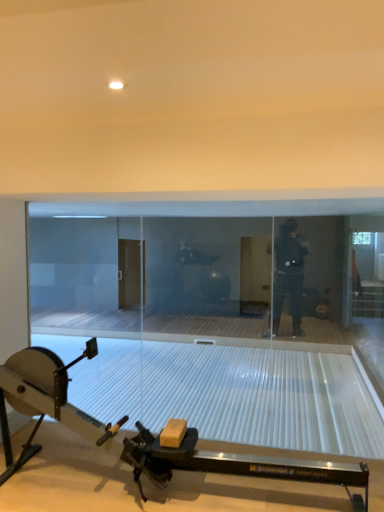
At what (x,y) coordinates should I click in order to perform the action: click on vacant region under metallic rowing machine at lower center (from a real-world perspective). Please return your answer as a coordinate pair (x, y). Looking at the image, I should click on (162, 506).